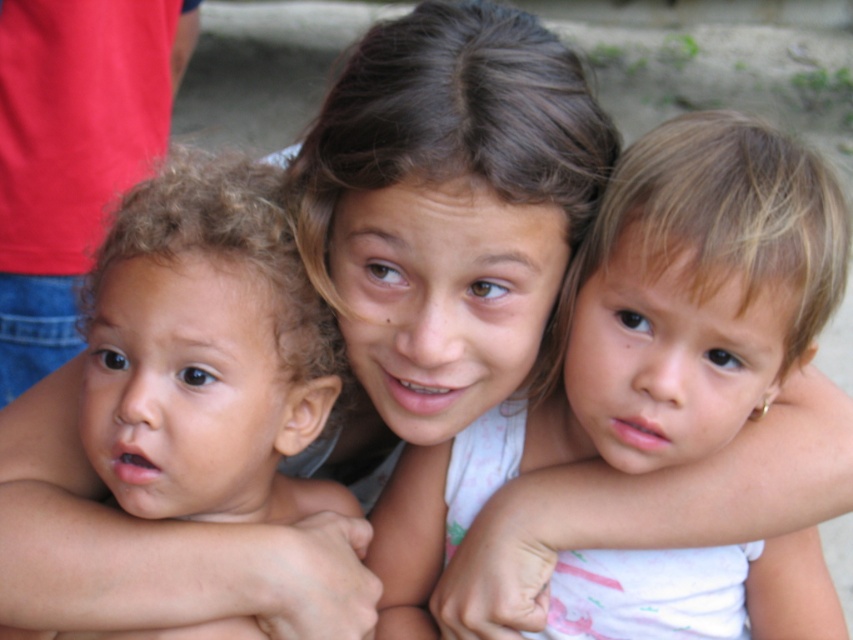
Based on the scene description, can you determine if the smooth skin child at center is positioned higher than the white fabric at upper center?

The smooth skin child at center is above the white fabric at upper center, so yes, the child is positioned higher than the fabric.

Please look at the image and identify which child the point at coordinate (x=643, y=336) is pointing to. The children are the child in the center with shoulder length brown hair, the child on the left with curly light brown hair, and the child on the right with short light brown hair. The options are the child in the center with shoulder length brown hair, the child on the left with curly light brown hair, or the child on the right with short light brown hair.

The point at coordinate (x=643, y=336) corresponds to the smooth skin child at center, so the correct answer is the child in the center with shoulder length brown hair.